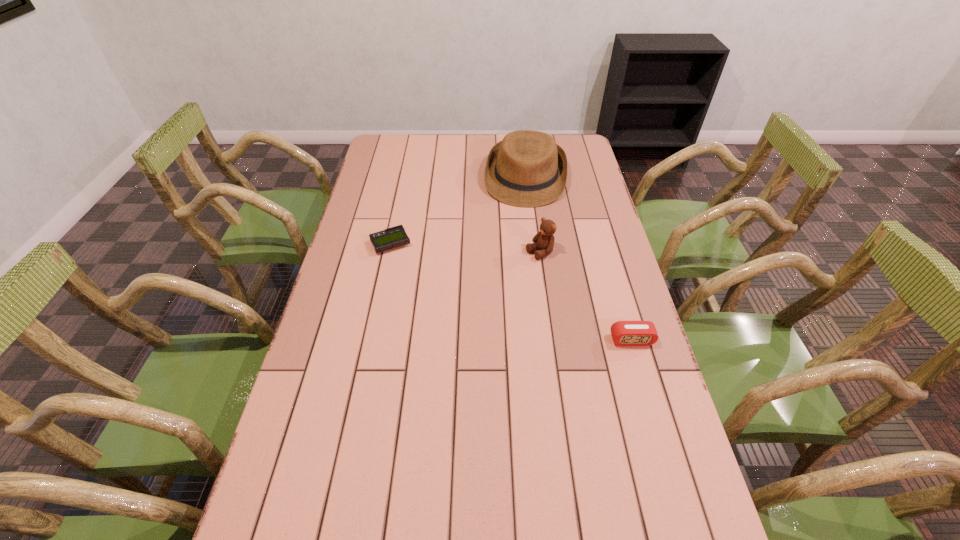
Where is `the leftmost object`? the leftmost object is located at coordinates (393, 237).

Image resolution: width=960 pixels, height=540 pixels. What are the coordinates of `the shortest object` in the screenshot? It's located at (393, 237).

Where is `the rightmost object`? This screenshot has width=960, height=540. the rightmost object is located at coordinates (624, 333).

Where is `the nearest object`? This screenshot has height=540, width=960. the nearest object is located at coordinates (624, 333).

Identify the location of fedora. Image resolution: width=960 pixels, height=540 pixels. (527, 168).

At what (x,y) coordinates should I click in order to perform the action: click on teddy bear. Please return your answer as a coordinate pair (x, y). This screenshot has width=960, height=540. Looking at the image, I should click on (544, 240).

This screenshot has height=540, width=960. In order to click on free space located 0.210m on the right of the beeper in this screenshot , I will do click(x=474, y=244).

This screenshot has width=960, height=540. In order to click on vacant region located 0.310m on the front-facing side of the nearest object in this screenshot , I will do `click(667, 464)`.

Where is `free space located on the front-facing side of the farthest object`? The image size is (960, 540). free space located on the front-facing side of the farthest object is located at coordinates (520, 225).

Image resolution: width=960 pixels, height=540 pixels. Identify the location of free region located on the front-facing side of the farthest object. (519, 232).